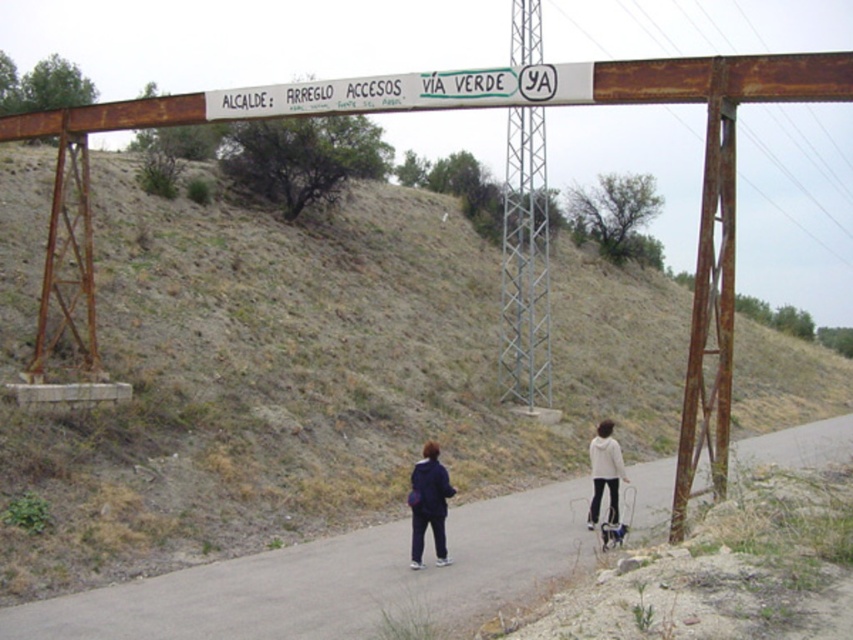
Question: Is asphalt road at center wider than matte blue jacket at center?

Choices:
 (A) no
 (B) yes

Answer: (B)

Question: Which of the following is the farthest from the observer?

Choices:
 (A) asphalt road at center
 (B) matte blue jacket at center

Answer: (B)

Question: Which of these objects is positioned closest to the dull brown dirt at upper center?

Choices:
 (A) matte blue jacket at center
 (B) asphalt road at center
 (C) white fleece jacket at lower right
 (D) white painted metal signboard at upper center

Answer: (B)

Question: Which object is positioned farthest from the asphalt road at center?

Choices:
 (A) white fleece jacket at lower right
 (B) dull brown dirt at upper center
 (C) matte blue jacket at center

Answer: (B)

Question: Is dull brown dirt at upper center thinner than matte blue jacket at center?

Choices:
 (A) no
 (B) yes

Answer: (A)

Question: Does asphalt road at center have a lesser width compared to matte blue jacket at center?

Choices:
 (A) no
 (B) yes

Answer: (A)